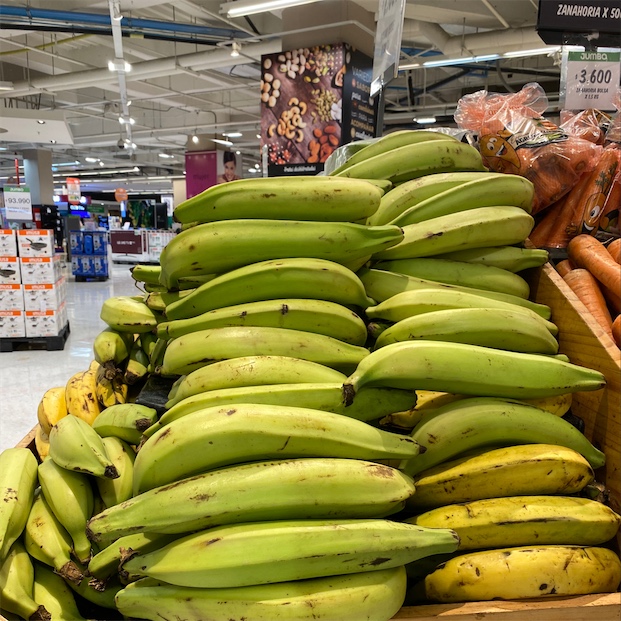
Locate an element on the screen. The width and height of the screenshot is (621, 621). wooden bin(s) is located at coordinates [x=566, y=605], [x=569, y=297].